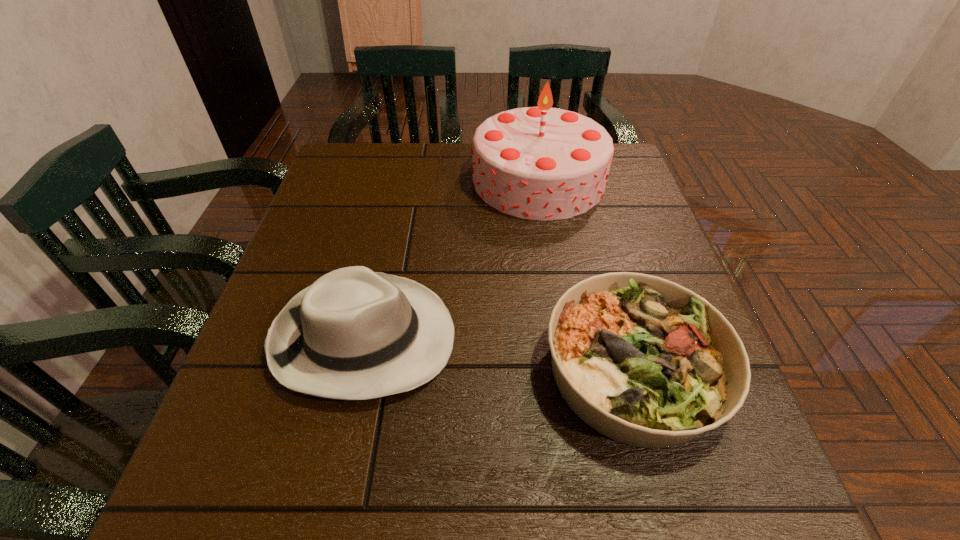
Identify the location of free spot that satisfies the following two spatial constraints: 1. on the front-facing side of the salad plate; 2. on the left side of the second tallest object. (357, 370).

Where is `blank space that satisfies the following two spatial constraints: 1. on the front-facing side of the shortest object; 2. on the left side of the fedora`? The image size is (960, 540). blank space that satisfies the following two spatial constraints: 1. on the front-facing side of the shortest object; 2. on the left side of the fedora is located at coordinates (357, 370).

Where is `vacant space that satisfies the following two spatial constraints: 1. on the front side of the birthday cake; 2. on the front-facing side of the fedora`? vacant space that satisfies the following two spatial constraints: 1. on the front side of the birthday cake; 2. on the front-facing side of the fedora is located at coordinates (564, 338).